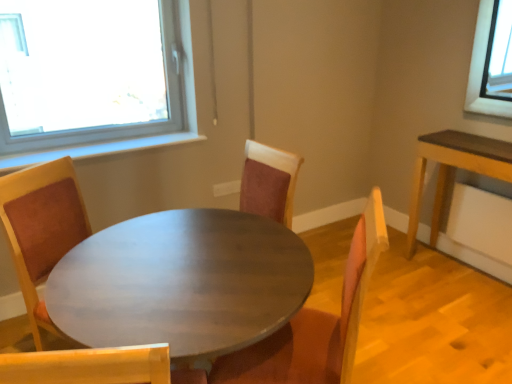
Question: Does matte wood table at center appear on the left side of suede-like brown chair at center?

Choices:
 (A) yes
 (B) no

Answer: (A)

Question: Considering the relative positions of matte wood table at center and suede-like brown chair at center in the image provided, is matte wood table at center in front of suede-like brown chair at center?

Choices:
 (A) yes
 (B) no

Answer: (A)

Question: Is matte wood table at center at the right side of suede-like brown chair at center?

Choices:
 (A) no
 (B) yes

Answer: (A)

Question: From the image's perspective, would you say matte wood table at center is positioned over suede-like brown chair at center?

Choices:
 (A) yes
 (B) no

Answer: (B)

Question: Is matte wood table at center not near suede-like brown chair at center?

Choices:
 (A) yes
 (B) no

Answer: (B)

Question: Could you tell me if matte wood table at center is facing suede-like brown chair at center?

Choices:
 (A) no
 (B) yes

Answer: (B)

Question: Does suede-like brown chair at center have a lesser width compared to matte wood table at center?

Choices:
 (A) no
 (B) yes

Answer: (B)

Question: Considering the relative sizes of suede-like brown chair at center and matte wood table at center in the image provided, is suede-like brown chair at center smaller than matte wood table at center?

Choices:
 (A) yes
 (B) no

Answer: (A)

Question: Is suede-like brown chair at center bigger than matte wood table at center?

Choices:
 (A) yes
 (B) no

Answer: (B)

Question: Does suede-like brown chair at center come in front of matte wood table at center?

Choices:
 (A) no
 (B) yes

Answer: (A)

Question: Does suede-like brown chair at center lie behind matte wood table at center?

Choices:
 (A) yes
 (B) no

Answer: (A)

Question: Can you confirm if suede-like brown chair at center is taller than matte wood table at center?

Choices:
 (A) no
 (B) yes

Answer: (B)

Question: Considering the positions of suede-like brown chair at center and matte wood table at center in the image, is suede-like brown chair at center wider or thinner than matte wood table at center?

Choices:
 (A) thin
 (B) wide

Answer: (A)